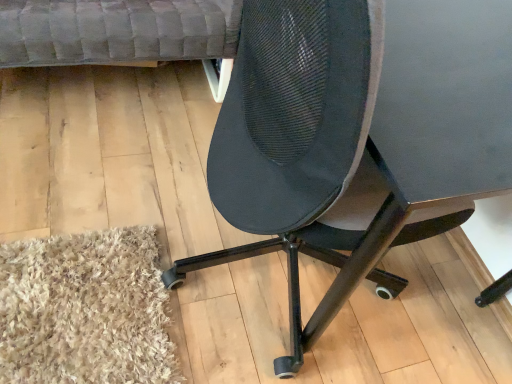
Measure the distance between black mesh chair at center and camera.

36.51 centimeters.

Describe the element at coordinates (358, 134) in the screenshot. This screenshot has width=512, height=384. I see `black mesh chair at center` at that location.

Measure the distance between point (336, 248) and camera.

A distance of 78.20 centimeters exists between point (336, 248) and camera.

This screenshot has width=512, height=384. I want to click on black mesh chair at center, so click(x=358, y=134).

Where is `velvet grey couch at upper left`? velvet grey couch at upper left is located at coordinates (122, 34).

What do you see at coordinates (122, 34) in the screenshot? I see `velvet grey couch at upper left` at bounding box center [122, 34].

What is the approximate height of velvet grey couch at upper left?

17.79 inches.

The image size is (512, 384). I want to click on black mesh chair at center, so click(358, 134).

Which object is positioned more to the right, velvet grey couch at upper left or black mesh chair at center?

black mesh chair at center.

Is the depth of velvet grey couch at upper left greater than that of black mesh chair at center?

Yes, velvet grey couch at upper left is further from the viewer.

Is point (196, 46) positioned after point (295, 110)?

That is True.

From the image's perspective, is velvet grey couch at upper left on black mesh chair at center?

Yes.

From a real-world perspective, is velvet grey couch at upper left above or below black mesh chair at center?

Clearly, from a real-world perspective, velvet grey couch at upper left is below black mesh chair at center.

In terms of width, does velvet grey couch at upper left look wider or thinner when compared to black mesh chair at center?

Clearly, velvet grey couch at upper left has more width compared to black mesh chair at center.

Is velvet grey couch at upper left taller than black mesh chair at center?

Incorrect, the height of velvet grey couch at upper left is not larger of that of black mesh chair at center.

In terms of size, does velvet grey couch at upper left appear bigger or smaller than black mesh chair at center?

Considering their sizes, velvet grey couch at upper left takes up less space than black mesh chair at center.

Is velvet grey couch at upper left inside the boundaries of black mesh chair at center, or outside?

velvet grey couch at upper left is spatially situated outside black mesh chair at center.

Is velvet grey couch at upper left not close to black mesh chair at center?

velvet grey couch at upper left is actually quite close to black mesh chair at center.

Is velvet grey couch at upper left facing towards black mesh chair at center?

Yes, velvet grey couch at upper left is turned towards black mesh chair at center.

Can you tell me how much velvet grey couch at upper left and black mesh chair at center differ in facing direction?

The facing directions of velvet grey couch at upper left and black mesh chair at center are 88.8 degrees apart.

The height and width of the screenshot is (384, 512). What are the coordinates of `couch above the black mesh chair at center (from the image's perspective)` in the screenshot? It's located at (122, 34).

Which object is positioned more to the left, black mesh chair at center or velvet grey couch at upper left?

Positioned to the left is velvet grey couch at upper left.

Considering the relative positions of black mesh chair at center and velvet grey couch at upper left in the image provided, is black mesh chair at center behind velvet grey couch at upper left?

No, it is in front of velvet grey couch at upper left.

Which is closer, (258, 192) or (126, 4)?

Clearly, point (258, 192) is closer to the camera than point (126, 4).

From the image's perspective, which object appears higher, black mesh chair at center or velvet grey couch at upper left?

velvet grey couch at upper left, from the image's perspective.

From a real-world perspective, is black mesh chair at center above or below velvet grey couch at upper left?

black mesh chair at center is situated higher than velvet grey couch at upper left in the real world.

Is black mesh chair at center thinner than velvet grey couch at upper left?

Yes, black mesh chair at center is thinner than velvet grey couch at upper left.

Can you confirm if black mesh chair at center is shorter than velvet grey couch at upper left?

In fact, black mesh chair at center may be taller than velvet grey couch at upper left.

Can you confirm if black mesh chair at center is bigger than velvet grey couch at upper left?

Yes.

Which is correct: black mesh chair at center is inside velvet grey couch at upper left, or outside of it?

black mesh chair at center is not enclosed by velvet grey couch at upper left.

Are black mesh chair at center and velvet grey couch at upper left far apart?

They are positioned close to each other.

Is black mesh chair at center oriented away from velvet grey couch at upper left?

No, black mesh chair at center is not facing the opposite direction of velvet grey couch at upper left.

Identify the location of couch above the black mesh chair at center (from the image's perspective). This screenshot has width=512, height=384. (122, 34).

Locate an element on the screen. This screenshot has height=384, width=512. couch that is under the black mesh chair at center (from a real-world perspective) is located at coordinates click(122, 34).

Identify the location of couch on the left of black mesh chair at center. This screenshot has height=384, width=512. (122, 34).